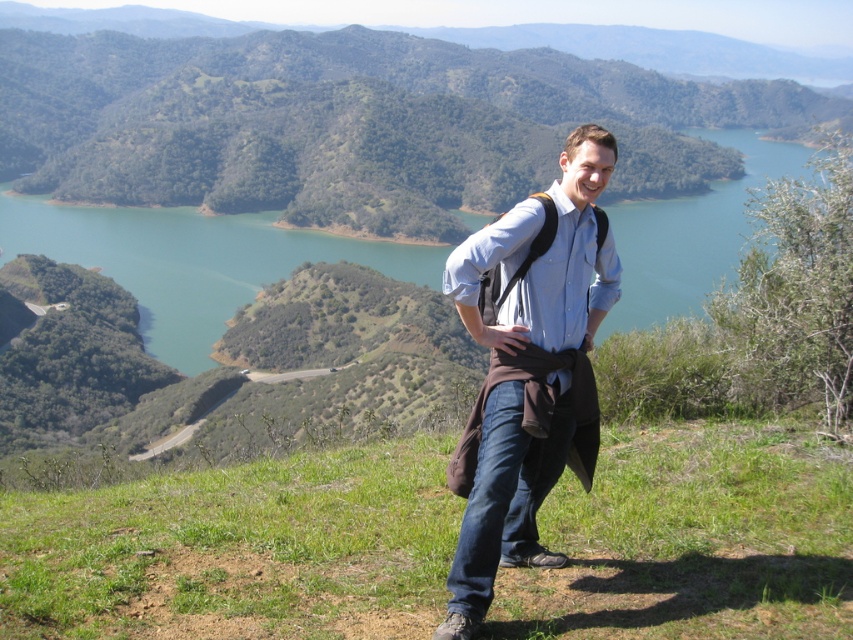
You are a drone operator trying to capture a photo of the blue cotton shirt at center from above the green grassy hill at center. Given that your drone can only fly up to 500 meters, will you be able to reach the shirt?

The distance between the green grassy hill at center and the blue cotton shirt at center is 555.31 meters. Since the drone has a maximum range of 500 meters, it cannot reach the shirt.

You are a photographer trying to capture the best angle of the blue cotton shirt at center and the green grassy hill at center. Since you want to emphasize the height difference between them, which object should you position closer to the foreground to highlight this contrast?

To emphasize the height difference between the green grassy hill at center and the blue cotton shirt at center, position the green grassy hill at center closer to the foreground. Since the hill is taller than the shirt, placing it in the foreground will make its height more pronounced against the background.